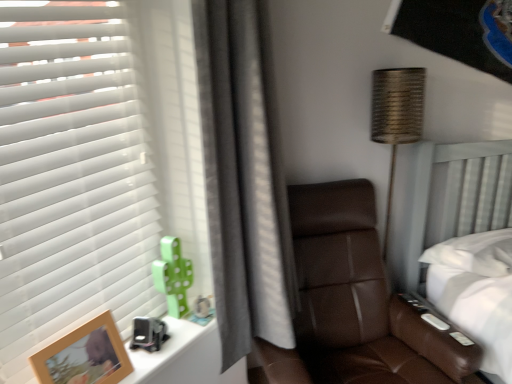
Question: Is wooden photo frame at lower left turned away from brown leather chair at center?

Choices:
 (A) no
 (B) yes

Answer: (A)

Question: From a real-world perspective, is wooden photo frame at lower left on top of brown leather chair at center?

Choices:
 (A) no
 (B) yes

Answer: (B)

Question: Does wooden photo frame at lower left turn towards brown leather chair at center?

Choices:
 (A) yes
 (B) no

Answer: (B)

Question: Does wooden photo frame at lower left appear on the right side of brown leather chair at center?

Choices:
 (A) yes
 (B) no

Answer: (B)

Question: Considering the relative positions of wooden photo frame at lower left and brown leather chair at center in the image provided, is wooden photo frame at lower left behind brown leather chair at center?

Choices:
 (A) yes
 (B) no

Answer: (B)

Question: Is brown leather chair at center taller or shorter than gray fabric curtain at center?

Choices:
 (A) tall
 (B) short

Answer: (B)

Question: From a real-world perspective, relative to gray fabric curtain at center, is brown leather chair at center vertically above or below?

Choices:
 (A) below
 (B) above

Answer: (A)

Question: Which is correct: brown leather chair at center is inside gray fabric curtain at center, or outside of it?

Choices:
 (A) outside
 (B) inside

Answer: (A)

Question: Relative to gray fabric curtain at center, is brown leather chair at center in front or behind?

Choices:
 (A) behind
 (B) front

Answer: (A)

Question: In the image, is wooden photo frame at lower left on the left side or the right side of white matte window blind at left?

Choices:
 (A) right
 (B) left

Answer: (A)

Question: Which is correct: wooden photo frame at lower left is inside white matte window blind at left, or outside of it?

Choices:
 (A) outside
 (B) inside

Answer: (B)

Question: Is point (80, 357) positioned closer to the camera than point (34, 263)?

Choices:
 (A) farther
 (B) closer

Answer: (A)

Question: In terms of size, does wooden photo frame at lower left appear bigger or smaller than white matte window blind at left?

Choices:
 (A) big
 (B) small

Answer: (B)

Question: Considering the positions of green matte cactus at left and white matte window blind at left in the image, is green matte cactus at left taller or shorter than white matte window blind at left?

Choices:
 (A) short
 (B) tall

Answer: (A)

Question: From a real-world perspective, is green matte cactus at left above or below white matte window blind at left?

Choices:
 (A) above
 (B) below

Answer: (B)